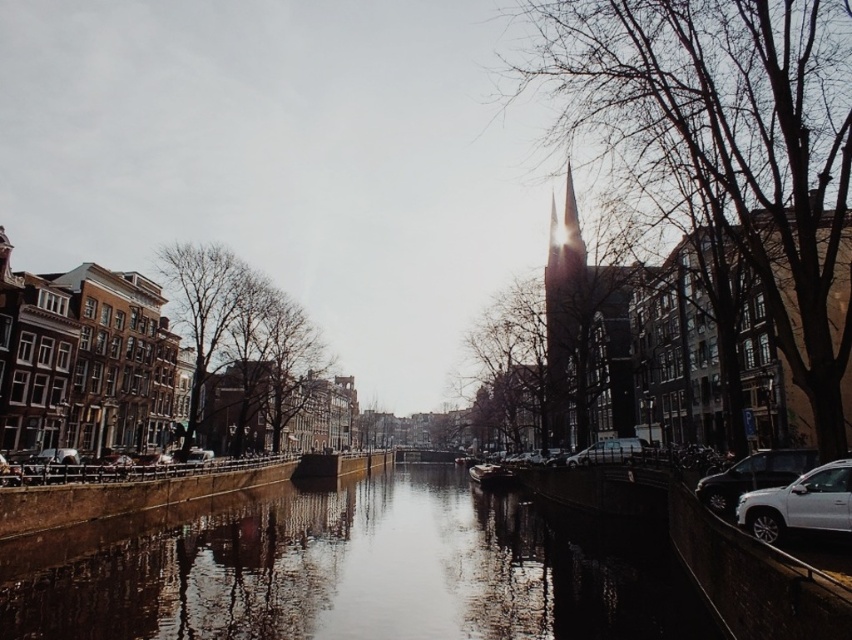
You are an architect analyzing the urban canal scene. You need to determine the relative heights of the smooth concrete water at center and the bare branches at left. Which one is taller?

The bare branches at left are taller than the smooth concrete water at center.

Looking at this image, what is located at the point marked as coordinates (727, 147) in the scene?

A: The point marked as coordinates (727, 147) in the scene is where the bare branches at upper right are located.

You are a photographer planning to capture the entire scene in one shot. Given that your camera has a limited field of view, which object between the smooth concrete water at center and the brown textured tree at center should you prioritize framing closer to the center of the photo to ensure both are visible?

The smooth concrete water at center is wider than the brown textured tree at center. To ensure both are visible in the photo, prioritize framing the narrower brown textured tree at center closer to the center of the photo, while allowing the wider smooth concrete water at center to occupy more space on the sides.